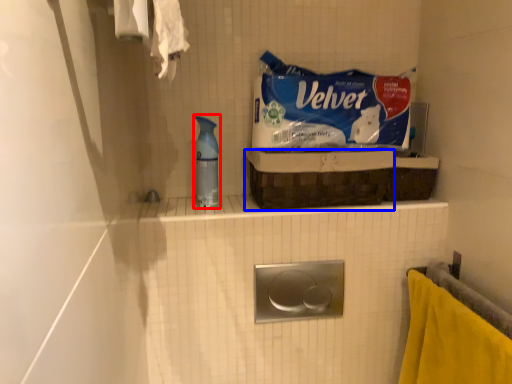
Question: Among these objects, which one is nearest to the camera, cleaning product (highlighted by a red box) or basket (highlighted by a blue box)?

Choices:
 (A) cleaning product
 (B) basket

Answer: (B)